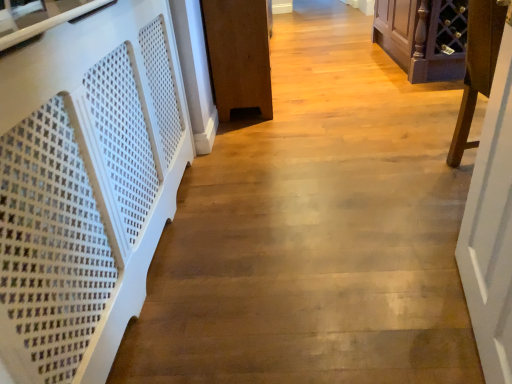
The width and height of the screenshot is (512, 384). I want to click on free space that is to the left of purple wood wine rack at right, which appears as the 2th furniture when viewed from the left, so click(x=392, y=185).